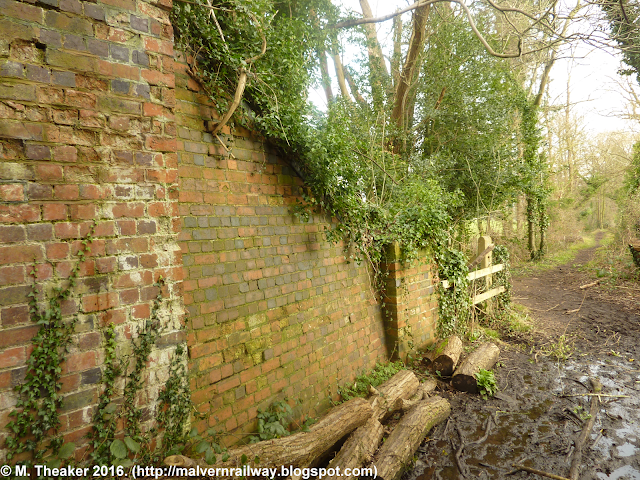
The height and width of the screenshot is (480, 640). Identify the location of wall. (166, 330).